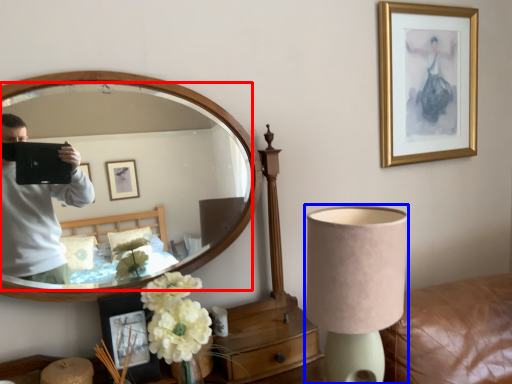
Question: Which object is further to the camera taking this photo, mirror (highlighted by a red box) or lamp (highlighted by a blue box)?

Choices:
 (A) mirror
 (B) lamp

Answer: (A)